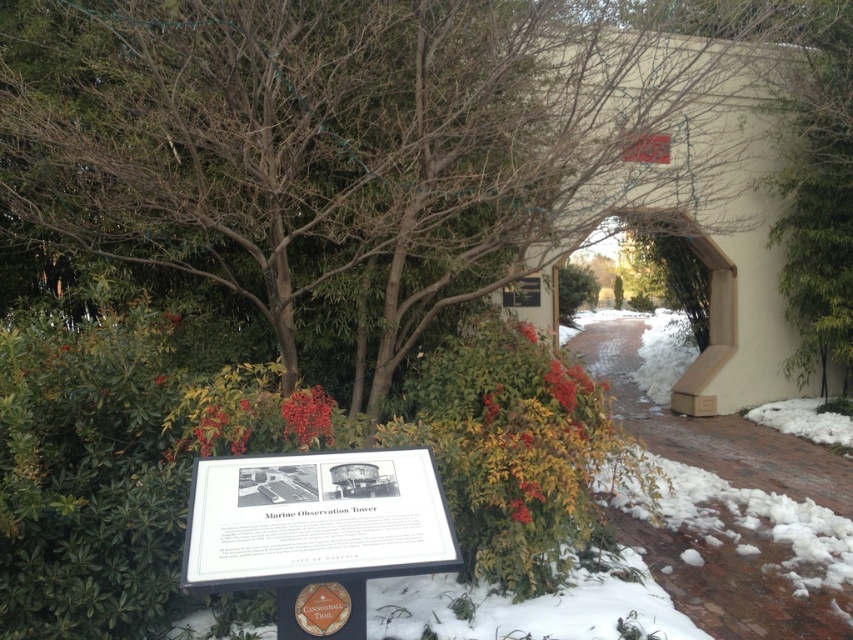
Does brown leafy tree at center appear on the right side of brick at center?

No, brown leafy tree at center is not to the right of brick at center.

Does brown leafy tree at center appear on the left side of brick at center?

Correct, you'll find brown leafy tree at center to the left of brick at center.

Who is more forward, [270,147] or [676,497]?

Positioned in front is point [270,147].

Where is `brown leafy tree at center`? brown leafy tree at center is located at coordinates (370, 140).

Which is more to the left, brown leafy tree at center or white plastic sign at center?

Positioned to the left is brown leafy tree at center.

Is point (186, 128) positioned behind point (215, 512)?

Yes.

At what (x,y) coordinates should I click in order to perform the action: click on brown leafy tree at center. Please return your answer as a coordinate pair (x, y). The image size is (853, 640). Looking at the image, I should click on (370, 140).

Is brick at center shorter than white plastic sign at center?

In fact, brick at center may be taller than white plastic sign at center.

Is point (625, 388) closer to viewer compared to point (218, 518)?

No, it is behind (218, 518).

Identify the location of brick at center. (738, 576).